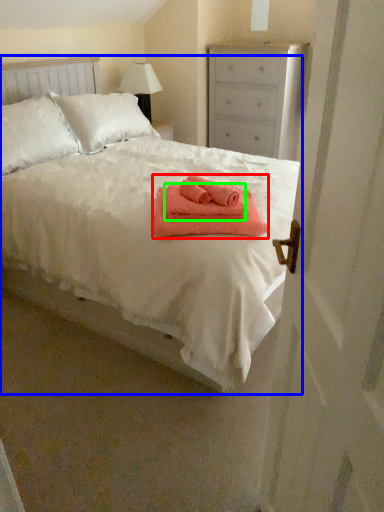
Question: Based on their relative distances, which object is nearer to bath towel (highlighted by a red box)? Choose from bed (highlighted by a blue box) and bath towel (highlighted by a green box).

Choices:
 (A) bed
 (B) bath towel

Answer: (B)